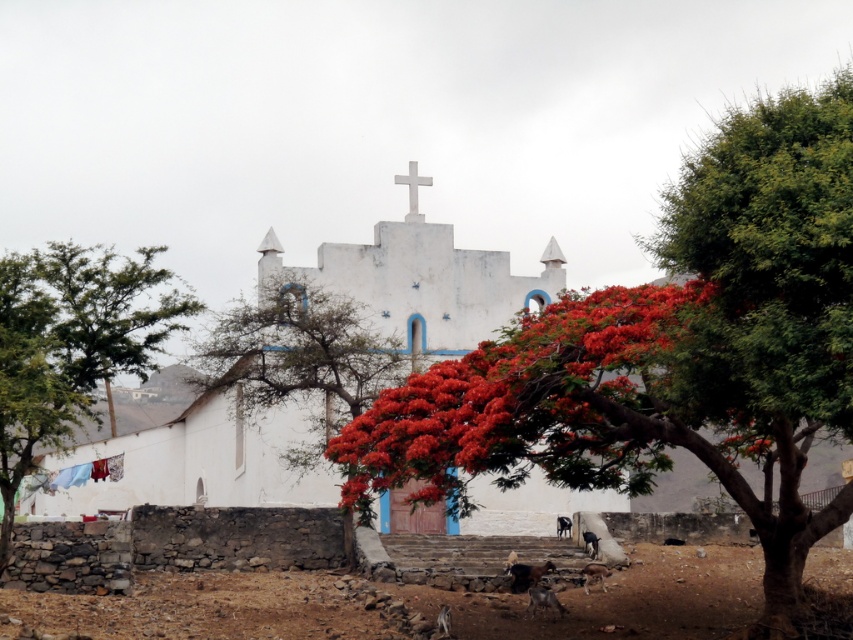
Is the position of red leafy tree at center more distant than that of smooth white tree at center?

No, it is in front of smooth white tree at center.

Is red leafy tree at center below smooth white tree at center?

Actually, red leafy tree at center is above smooth white tree at center.

Measure the distance between point (798, 253) and camera.

Point (798, 253) is 220.45 feet from camera.

Find the location of a particular element. red leafy tree at center is located at coordinates (669, 352).

What do you see at coordinates (541, 403) in the screenshot? The image size is (853, 640). I see `bright red leaves at center` at bounding box center [541, 403].

Looking at this image, who is more distant from viewer, (498, 380) or (86, 506)?

Point (86, 506)

This screenshot has width=853, height=640. What are the coordinates of `bright red leaves at center` in the screenshot? It's located at (541, 403).

This screenshot has width=853, height=640. What are the coordinates of `bright red leaves at center` in the screenshot? It's located at (541, 403).

Is brown dirt field at lower center bigger than white matte cross at center?

Indeed, brown dirt field at lower center has a larger size compared to white matte cross at center.

Based on the photo, who is positioned more to the right, brown dirt field at lower center or white matte cross at center?

brown dirt field at lower center is more to the right.

Is point (706, 582) closer to camera compared to point (405, 180)?

Yes.

Where is `brown dirt field at lower center`? The height and width of the screenshot is (640, 853). brown dirt field at lower center is located at coordinates (405, 604).